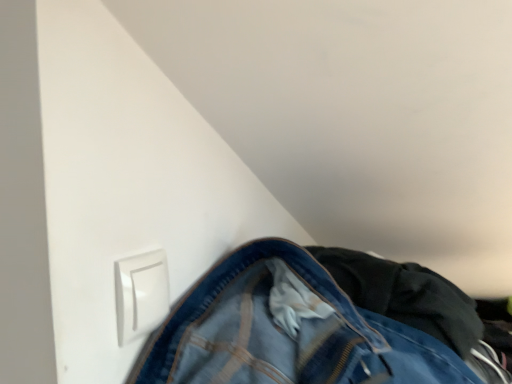
Question: Is denim at lower right further to camera compared to white plastic switch at lower left?

Choices:
 (A) no
 (B) yes

Answer: (B)

Question: Considering the relative positions of denim at lower right and white plastic switch at lower left in the image provided, is denim at lower right to the right of white plastic switch at lower left from the viewer's perspective?

Choices:
 (A) no
 (B) yes

Answer: (B)

Question: Does denim at lower right have a lesser height compared to white plastic switch at lower left?

Choices:
 (A) no
 (B) yes

Answer: (A)

Question: Is denim at lower right taller than white plastic switch at lower left?

Choices:
 (A) no
 (B) yes

Answer: (B)

Question: Is white plastic switch at lower left at the back of denim at lower right?

Choices:
 (A) no
 (B) yes

Answer: (A)

Question: Considering the relative sizes of denim at lower right and white plastic switch at lower left in the image provided, is denim at lower right bigger than white plastic switch at lower left?

Choices:
 (A) yes
 (B) no

Answer: (A)

Question: From the image's perspective, is white plastic switch at lower left above denim at lower right?

Choices:
 (A) yes
 (B) no

Answer: (A)

Question: Is white plastic switch at lower left located outside denim at lower right?

Choices:
 (A) no
 (B) yes

Answer: (B)

Question: Considering the relative sizes of white plastic switch at lower left and denim at lower right in the image provided, is white plastic switch at lower left wider than denim at lower right?

Choices:
 (A) yes
 (B) no

Answer: (B)

Question: Is the depth of white plastic switch at lower left less than that of denim at lower right?

Choices:
 (A) no
 (B) yes

Answer: (B)

Question: Is there a large distance between white plastic switch at lower left and denim at lower right?

Choices:
 (A) yes
 (B) no

Answer: (B)

Question: Is the position of white plastic switch at lower left more distant than that of denim at lower right?

Choices:
 (A) no
 (B) yes

Answer: (A)

Question: Is white plastic switch at lower left to the left or to the right of denim at lower right in the image?

Choices:
 (A) left
 (B) right

Answer: (A)